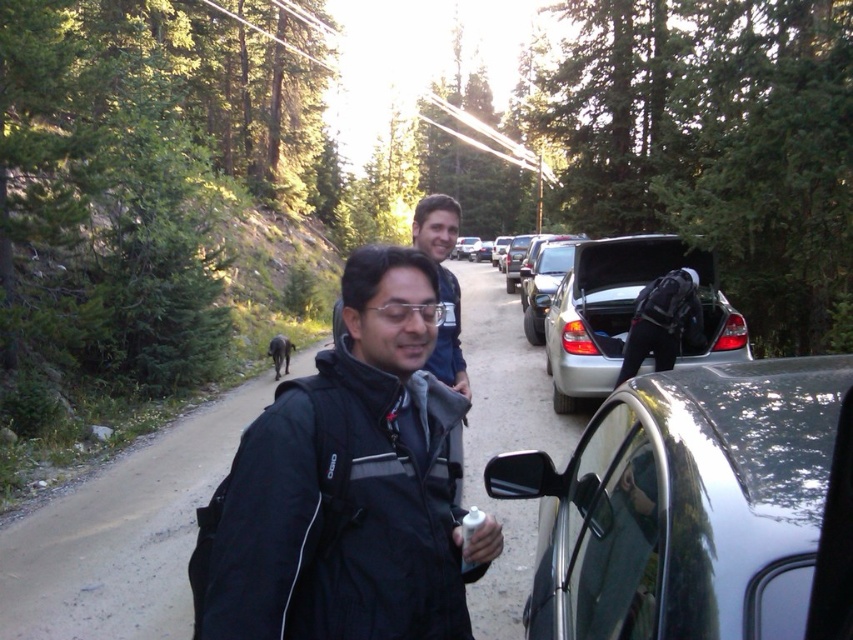
Which is in front, point (572, 326) or point (444, 196)?

Positioned in front is point (444, 196).

Is satin silver suv at right above matte blue shirt at center?

Incorrect, satin silver suv at right is not positioned above matte blue shirt at center.

The width and height of the screenshot is (853, 640). I want to click on satin silver suv at right, so click(x=625, y=314).

Who is more distant from viewer, (322, 496) or (602, 380)?

The point (602, 380) is more distant.

Which is below, black softshell jacket at center or satin silver suv at right?

black softshell jacket at center

Which is in front, point (297, 592) or point (602, 253)?

Positioned in front is point (297, 592).

Identify the location of black softshell jacket at center. This screenshot has height=640, width=853. (346, 486).

Is point (424, 246) more distant than point (474, 250)?

No.

In the scene shown: Which is above, matte blue shirt at center or satin silver car at center?

satin silver car at center is higher up.

Is point (433, 196) positioned in front of point (477, 241)?

Yes, it is in front of point (477, 241).

Find the location of `matte blue shirt at center`. matte blue shirt at center is located at coordinates (442, 284).